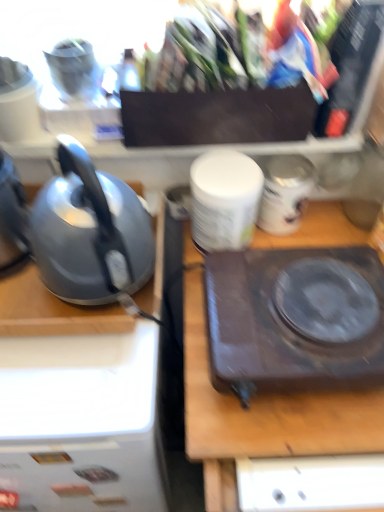
Question: From the image's perspective, would you say dark brown plastic hot plate at center is shown under satin grey kettle at left?

Choices:
 (A) no
 (B) yes

Answer: (B)

Question: Are dark brown plastic hot plate at center and satin grey kettle at left located far from each other?

Choices:
 (A) no
 (B) yes

Answer: (A)

Question: Does dark brown plastic hot plate at center have a smaller size compared to satin grey kettle at left?

Choices:
 (A) yes
 (B) no

Answer: (A)

Question: Is satin grey kettle at left a part of dark brown plastic hot plate at center?

Choices:
 (A) yes
 (B) no

Answer: (B)

Question: From a real-world perspective, is dark brown plastic hot plate at center on top of satin grey kettle at left?

Choices:
 (A) no
 (B) yes

Answer: (A)

Question: From a real-world perspective, is white matte container at center physically located above or below satin grey kettle at left?

Choices:
 (A) above
 (B) below

Answer: (B)

Question: From the image's perspective, is white matte container at center located above or below satin grey kettle at left?

Choices:
 (A) above
 (B) below

Answer: (A)

Question: Considering the positions of white matte container at center and satin grey kettle at left in the image, is white matte container at center wider or thinner than satin grey kettle at left?

Choices:
 (A) thin
 (B) wide

Answer: (A)

Question: Choose the correct answer: Is white matte container at center inside satin grey kettle at left or outside it?

Choices:
 (A) inside
 (B) outside

Answer: (B)

Question: Based on their sizes in the image, would you say white matte container at center is bigger or smaller than brown matte electric stove at center?

Choices:
 (A) big
 (B) small

Answer: (B)

Question: Is white matte container at center taller or shorter than brown matte electric stove at center?

Choices:
 (A) short
 (B) tall

Answer: (A)

Question: Is white matte container at center wider or thinner than brown matte electric stove at center?

Choices:
 (A) wide
 (B) thin

Answer: (B)

Question: Do you think white matte container at center is within brown matte electric stove at center, or outside of it?

Choices:
 (A) outside
 (B) inside

Answer: (A)

Question: Considering the positions of dark brown plastic hot plate at center and white glossy jar at center in the image, is dark brown plastic hot plate at center taller or shorter than white glossy jar at center?

Choices:
 (A) short
 (B) tall

Answer: (A)

Question: From the image's perspective, is dark brown plastic hot plate at center above or below white glossy jar at center?

Choices:
 (A) below
 (B) above

Answer: (A)